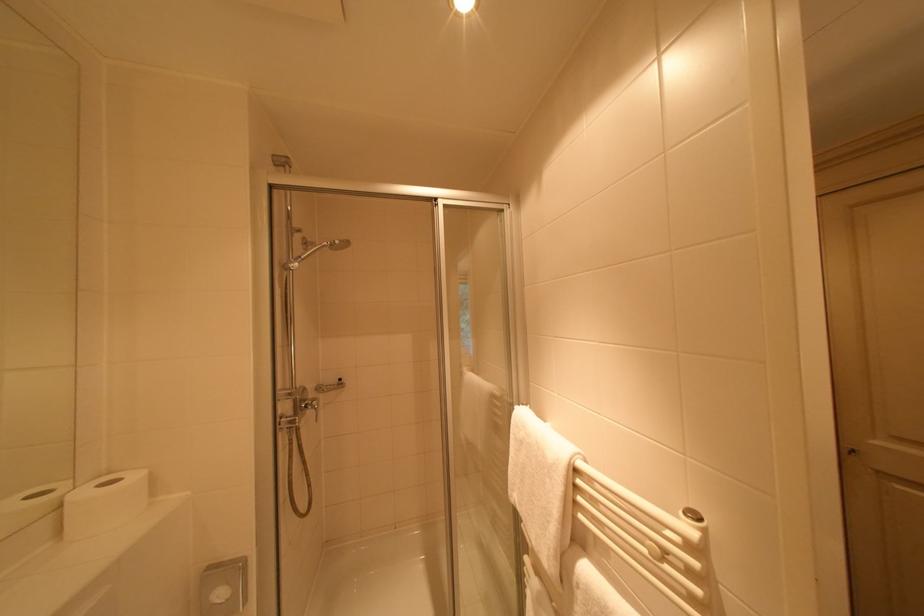
Describe the element at coordinates (219, 594) in the screenshot. The image size is (924, 616). I see `the square wall button` at that location.